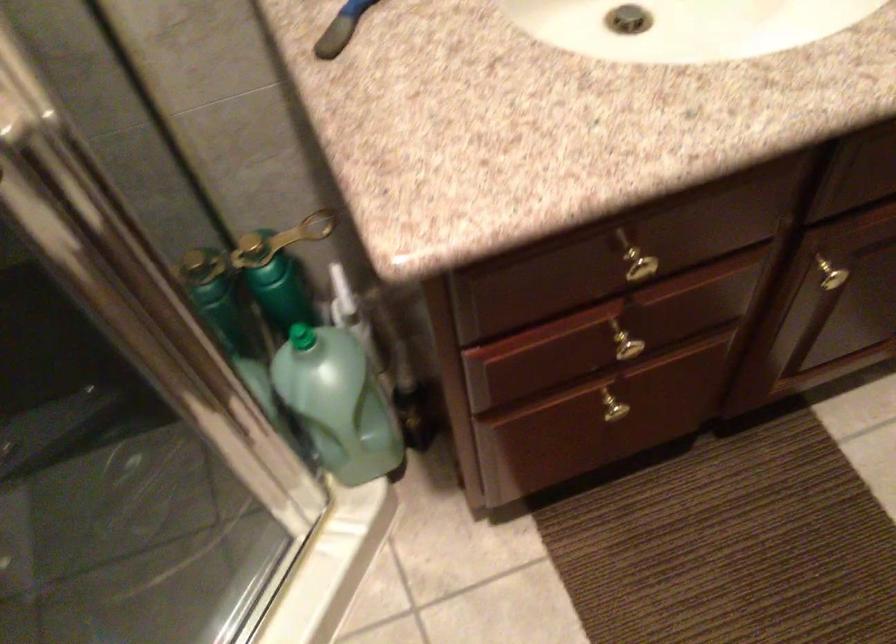
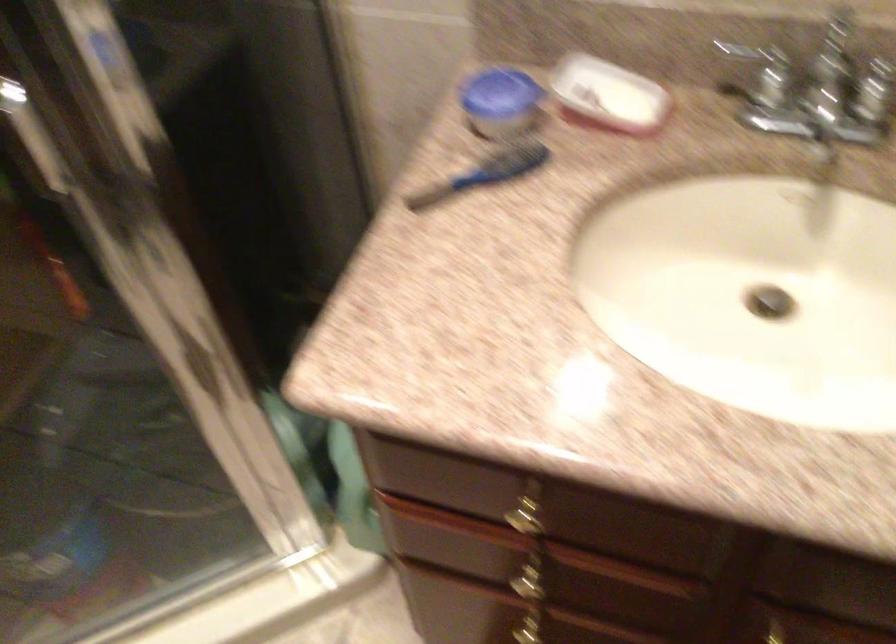
Question: The camera is either moving clockwise (left) or counter-clockwise (right) around the object. The first image is from the beginning of the video and the second image is from the end. Is the camera moving left or right when shooting the video?

Choices:
 (A) Left
 (B) Right

Answer: (B)